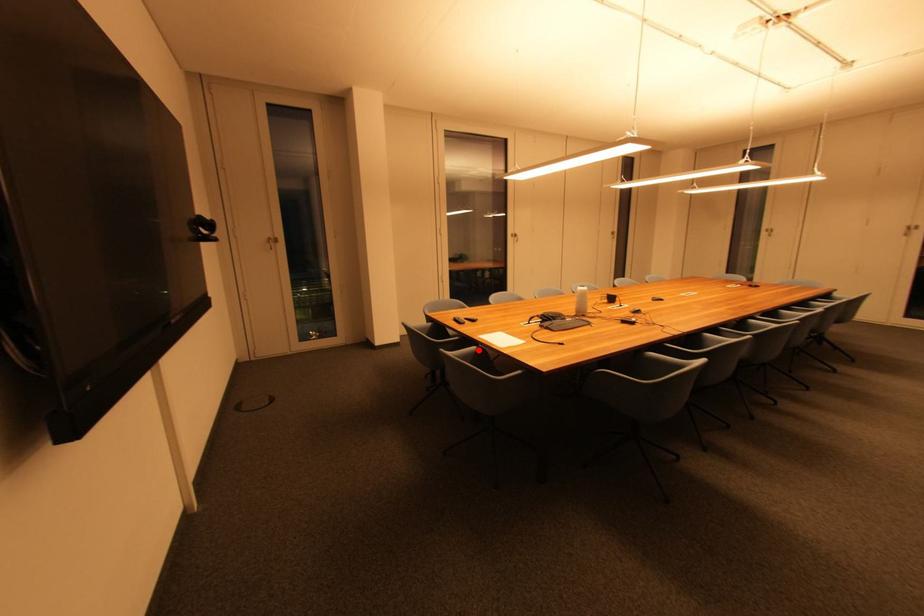
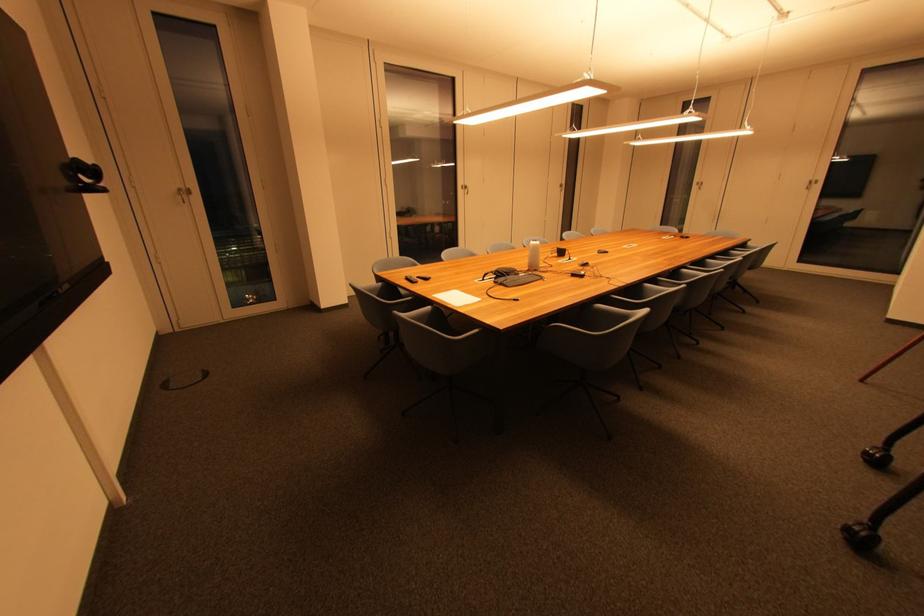
The point at the highlighted location is marked in the first image. Where is the corresponding point in the second image?

(433, 310)